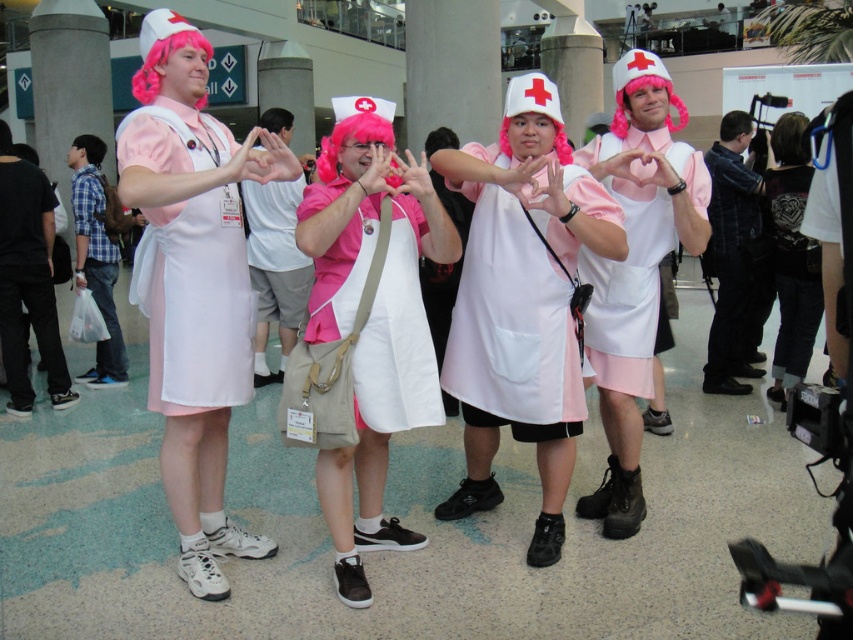
Question: Which point is closer to the camera?

Choices:
 (A) (132, 77)
 (B) (780, 141)
 (C) (227, 157)

Answer: (A)

Question: Which of the following is the farthest from the observer?

Choices:
 (A) pink matte dress at center
 (B) matte white apron at center
 (C) pink synthetic wig at upper left

Answer: (C)

Question: Does pink matte nurse uniform at center appear on the left side of pink synthetic wig at center?

Choices:
 (A) yes
 (B) no

Answer: (B)

Question: Does pink matte dress at center have a lesser width compared to pink matte nurse uniform at center?

Choices:
 (A) yes
 (B) no

Answer: (B)

Question: Is pink matte dress at center further to camera compared to pink synthetic wig at upper left?

Choices:
 (A) yes
 (B) no

Answer: (B)

Question: Which object is farther from the camera taking this photo?

Choices:
 (A) pink satin dress at center
 (B) pink matte dress at center
 (C) pink synthetic wig at upper left

Answer: (C)